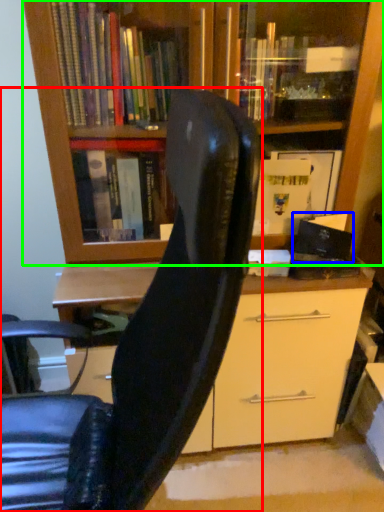
Question: Which is farther away from chair (highlighted by a red box)? paperback book (highlighted by a blue box) or bookcase (highlighted by a green box)?

Choices:
 (A) paperback book
 (B) bookcase

Answer: (A)